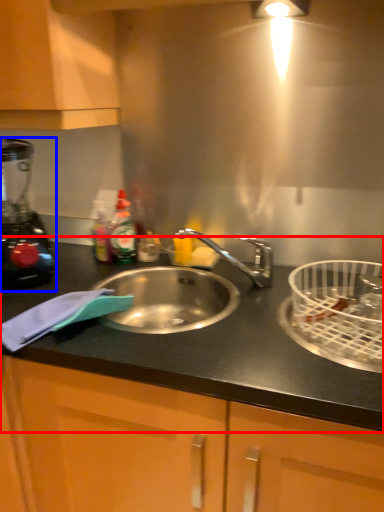
Question: Which point is closer to the camera, countertop (highlighted by a red box) or blender (highlighted by a blue box)?

Choices:
 (A) countertop
 (B) blender

Answer: (A)